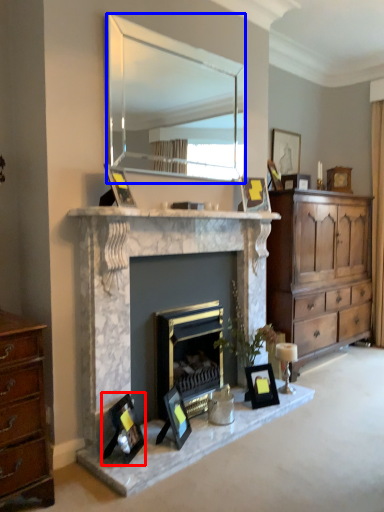
Question: Which point is closer to the camera, picture frame (highlighted by a red box) or mirror (highlighted by a blue box)?

Choices:
 (A) picture frame
 (B) mirror

Answer: (A)